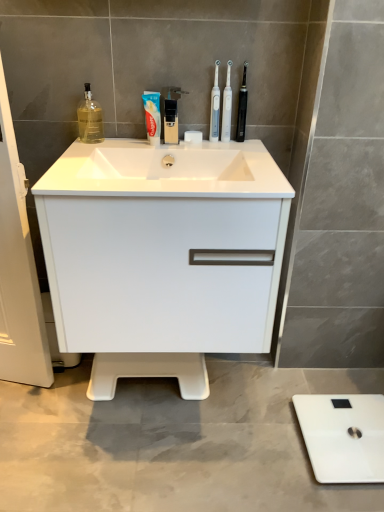
Question: From a real-world perspective, is black plastic faucet at upper center positioned under white plastic toothbrush at upper center, which is the third toothbrush from right to left, based on gravity?

Choices:
 (A) yes
 (B) no

Answer: (A)

Question: Is black plastic faucet at upper center bigger than white plastic toothbrush at upper center, which is the third toothbrush from right to left?

Choices:
 (A) yes
 (B) no

Answer: (A)

Question: From the image's perspective, would you say black plastic faucet at upper center is positioned over white plastic toothbrush at upper center, which is the third toothbrush from right to left?

Choices:
 (A) yes
 (B) no

Answer: (B)

Question: Is black plastic faucet at upper center at the left side of white plastic toothbrush at upper center, placed as the first toothbrush when sorted from left to right?

Choices:
 (A) no
 (B) yes

Answer: (B)

Question: Does black plastic faucet at upper center come behind white plastic toothbrush at upper center, placed as the first toothbrush when sorted from left to right?

Choices:
 (A) yes
 (B) no

Answer: (B)

Question: From the image's perspective, is black plastic faucet at upper center under white plastic toothbrush at upper center, placed as the first toothbrush when sorted from left to right?

Choices:
 (A) yes
 (B) no

Answer: (A)

Question: Could blue glossy toothpaste at center be considered to be inside white glossy cabinet at center?

Choices:
 (A) yes
 (B) no

Answer: (B)

Question: Does white glossy cabinet at center come behind blue glossy toothpaste at center?

Choices:
 (A) yes
 (B) no

Answer: (B)

Question: Is white glossy cabinet at center directly adjacent to blue glossy toothpaste at center?

Choices:
 (A) no
 (B) yes

Answer: (A)

Question: From a real-world perspective, is white glossy cabinet at center physically above blue glossy toothpaste at center?

Choices:
 (A) no
 (B) yes

Answer: (A)

Question: From a real-world perspective, is white glossy cabinet at center located beneath blue glossy toothpaste at center?

Choices:
 (A) yes
 (B) no

Answer: (A)

Question: Is blue glossy toothpaste at center at the back of white glossy cabinet at center?

Choices:
 (A) no
 (B) yes

Answer: (A)

Question: Is black plastic toothbrush at upper center, the first toothbrush viewed from the right, wider than white glossy cabinet at center?

Choices:
 (A) no
 (B) yes

Answer: (A)